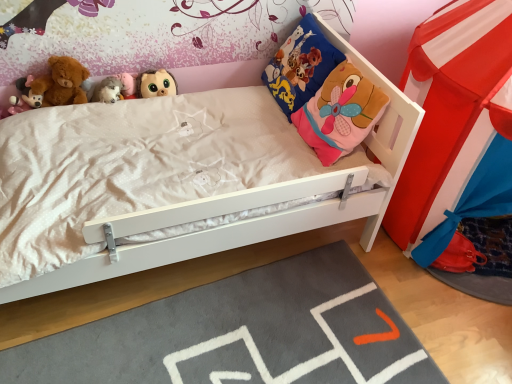
Question: Does blue fabric pillow at upper right have a lesser height compared to gray soft rug at lower center?

Choices:
 (A) yes
 (B) no

Answer: (B)

Question: Can you confirm if blue fabric pillow at upper right is wider than gray soft rug at lower center?

Choices:
 (A) yes
 (B) no

Answer: (B)

Question: Is blue fabric pillow at upper right positioned with its back to gray soft rug at lower center?

Choices:
 (A) no
 (B) yes

Answer: (A)

Question: Can you confirm if blue fabric pillow at upper right is thinner than gray soft rug at lower center?

Choices:
 (A) no
 (B) yes

Answer: (B)

Question: Is blue fabric pillow at upper right with gray soft rug at lower center?

Choices:
 (A) yes
 (B) no

Answer: (B)

Question: Is blue fabric pillow at upper right surrounding gray soft rug at lower center?

Choices:
 (A) yes
 (B) no

Answer: (B)

Question: From a real-world perspective, does matte brown plush toy at upper center, placed as the third toy when sorted from left to right, sit lower than blue fabric pillow at upper right?

Choices:
 (A) no
 (B) yes

Answer: (B)

Question: Can you confirm if matte brown plush toy at upper center, which is the 1th toy in right-to-left order, is thinner than blue fabric pillow at upper right?

Choices:
 (A) yes
 (B) no

Answer: (A)

Question: Does matte brown plush toy at upper center, placed as the third toy when sorted from left to right, appear on the left side of blue fabric pillow at upper right?

Choices:
 (A) no
 (B) yes

Answer: (B)

Question: Is matte brown plush toy at upper center, which is the 1th toy in right-to-left order, taller than blue fabric pillow at upper right?

Choices:
 (A) no
 (B) yes

Answer: (A)

Question: Is blue fabric pillow at upper right completely or partially inside matte brown plush toy at upper center, placed as the third toy when sorted from left to right?

Choices:
 (A) yes
 (B) no

Answer: (B)

Question: Is matte brown plush toy at upper center, which is the 1th toy in right-to-left order, not within blue fabric pillow at upper right?

Choices:
 (A) yes
 (B) no

Answer: (A)

Question: Does soft plush teddy bear at upper left have a larger size compared to matte pink plush toy at upper left, marked as the third toy in a right-to-left arrangement?

Choices:
 (A) yes
 (B) no

Answer: (A)